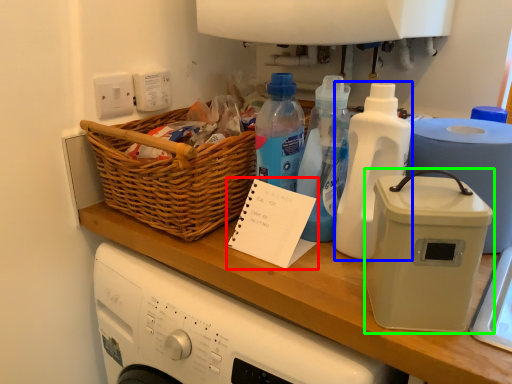
Question: Which object is positioned farthest from notepad (highlighted by a red box)? Select from bottle (highlighted by a blue box) and kitchen appliance (highlighted by a green box).

Choices:
 (A) bottle
 (B) kitchen appliance

Answer: (B)